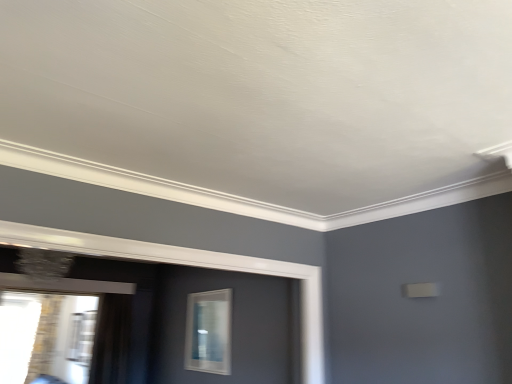
Question: Is transparent glass window at lower left, which is the first window in left-to-right order, not near clear glass window at center, the 2th window from the left?

Choices:
 (A) yes
 (B) no

Answer: (A)

Question: From the image's perspective, is transparent glass window at lower left, which is the first window in left-to-right order, located beneath clear glass window at center, the 2th window from the left?

Choices:
 (A) yes
 (B) no

Answer: (A)

Question: Can you confirm if transparent glass window at lower left, which appears as the 2th window when viewed from the right, is shorter than clear glass window at center, the 2th window from the left?

Choices:
 (A) no
 (B) yes

Answer: (A)

Question: Does transparent glass window at lower left, which appears as the 2th window when viewed from the right, appear on the left side of clear glass window at center, the 2th window from the left?

Choices:
 (A) no
 (B) yes

Answer: (B)

Question: Can you confirm if transparent glass window at lower left, which is the first window in left-to-right order, is thinner than clear glass window at center, which appears as the 1th window when viewed from the right?

Choices:
 (A) yes
 (B) no

Answer: (B)

Question: Relative to transparent glass window at lower left, which is the first window in left-to-right order, is black sheer curtain at left in front or behind?

Choices:
 (A) behind
 (B) front

Answer: (A)

Question: Is point (95, 382) closer or farther from the camera than point (70, 309)?

Choices:
 (A) farther
 (B) closer

Answer: (B)

Question: Would you say black sheer curtain at left is to the left or to the right of transparent glass window at lower left, which appears as the 2th window when viewed from the right, in the picture?

Choices:
 (A) left
 (B) right

Answer: (B)

Question: Is black sheer curtain at left bigger or smaller than transparent glass window at lower left, which appears as the 2th window when viewed from the right?

Choices:
 (A) small
 (B) big

Answer: (B)

Question: Is transparent glass window at lower left, which is the first window in left-to-right order, wider or thinner than clear glass window at center, the 2th window from the left?

Choices:
 (A) wide
 (B) thin

Answer: (A)

Question: Based on their sizes in the image, would you say transparent glass window at lower left, which is the first window in left-to-right order, is bigger or smaller than clear glass window at center, the 2th window from the left?

Choices:
 (A) small
 (B) big

Answer: (B)

Question: Is transparent glass window at lower left, which is the first window in left-to-right order, spatially inside clear glass window at center, which appears as the 1th window when viewed from the right, or outside of it?

Choices:
 (A) inside
 (B) outside

Answer: (B)

Question: Is point (11, 334) positioned closer to the camera than point (210, 331)?

Choices:
 (A) closer
 (B) farther

Answer: (B)

Question: Is clear glass window at center, which appears as the 1th window when viewed from the right, taller or shorter than transparent glass window at lower left, which is the first window in left-to-right order?

Choices:
 (A) short
 (B) tall

Answer: (A)

Question: Is clear glass window at center, which appears as the 1th window when viewed from the right, bigger or smaller than transparent glass window at lower left, which appears as the 2th window when viewed from the right?

Choices:
 (A) small
 (B) big

Answer: (A)